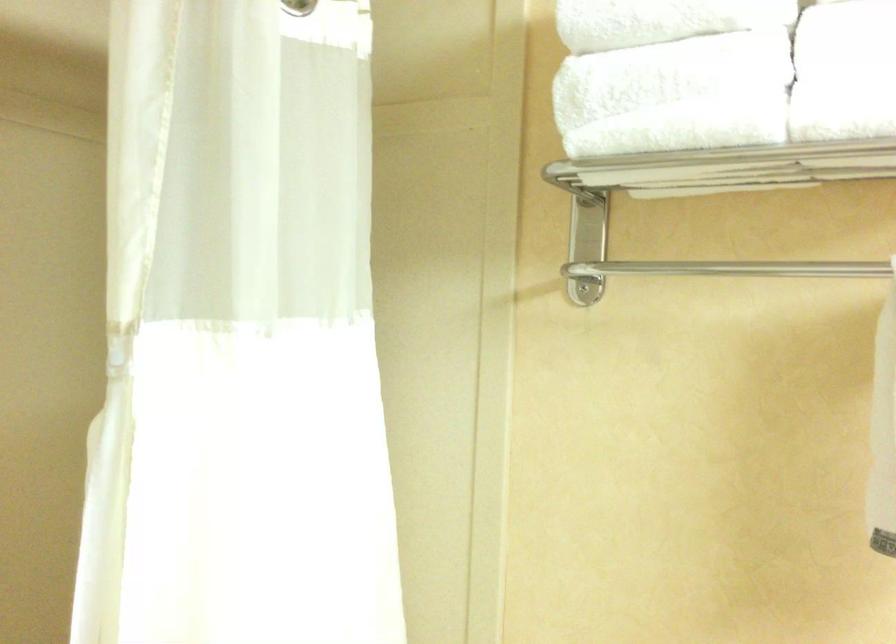
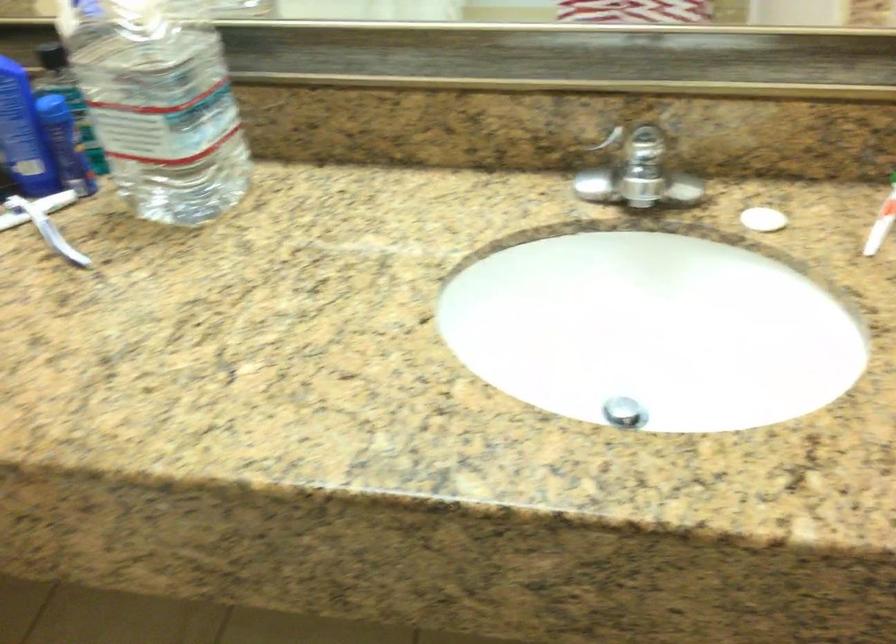
Based on the continuous images, in which direction is the camera rotating?

The rotation direction of the camera is right-down.